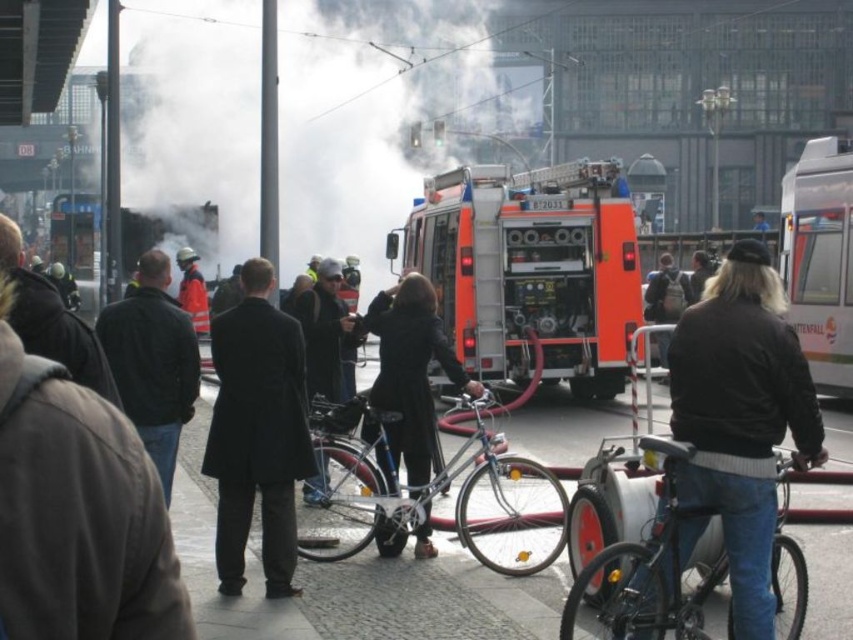
You are a photographer trying to capture both the shiny metallic bicycle at center and the black matte bicycle at center in a single frame. Which bicycle will appear bigger in your photo?

The shiny metallic bicycle at center will appear bigger in the photo because it is larger in size than the black matte bicycle at center.

Based on the photo, you are an emergency responder at the scene of a fire in a train station. You need to quickly identify which item of clothing is more suitable for covering your uniform. The two options are the dark brown leather jacket at center right and the dark brown leather coat at center. Which one should you choose based on their sizes?

The dark brown leather coat at center is larger and therefore more suitable for covering your uniform compared to the dark brown leather jacket at center right.

You are a photographer standing at the scene of a fire at a train station. You want to capture a photo of the shiny metallic bicycle at center without including the orange fire truck in the background. Is the bicycle close enough to the camera for you to frame it without the fire truck appearing in the shot?

The shiny metallic bicycle at center is 22.72 feet away from the camera. Since the fire truck is positioned centrally in the scene, moving closer to the bicycle might still include the fire truck in the background unless you adjust your angle. However, the exact positioning isn